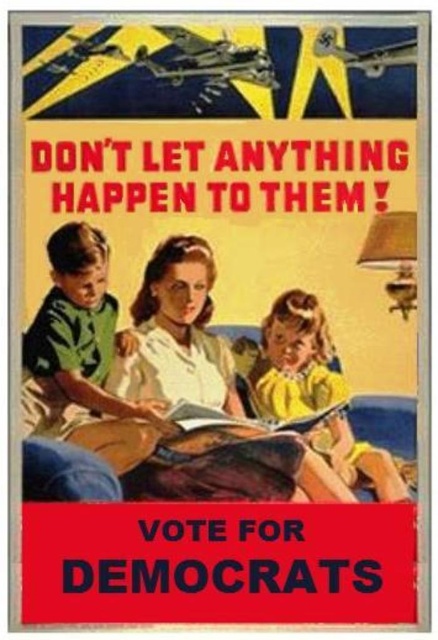
Question: Which point is farther from the camera taking this photo?

Choices:
 (A) (219, 424)
 (B) (288, 404)

Answer: (B)

Question: Which point appears farthest from the camera in this image?

Choices:
 (A) (56, 316)
 (B) (310, 392)
 (C) (215, 412)

Answer: (A)

Question: Does green matte shirt at left have a larger size compared to yellow matte dress at lower right?

Choices:
 (A) yes
 (B) no

Answer: (A)

Question: Does yellow matte dress at lower right appear on the left side of hardcover book at center?

Choices:
 (A) yes
 (B) no

Answer: (B)

Question: Can you confirm if green matte shirt at left is positioned below hardcover book at center?

Choices:
 (A) yes
 (B) no

Answer: (B)

Question: Which object appears farthest from the camera in this image?

Choices:
 (A) hardcover book at center
 (B) green matte shirt at left

Answer: (A)